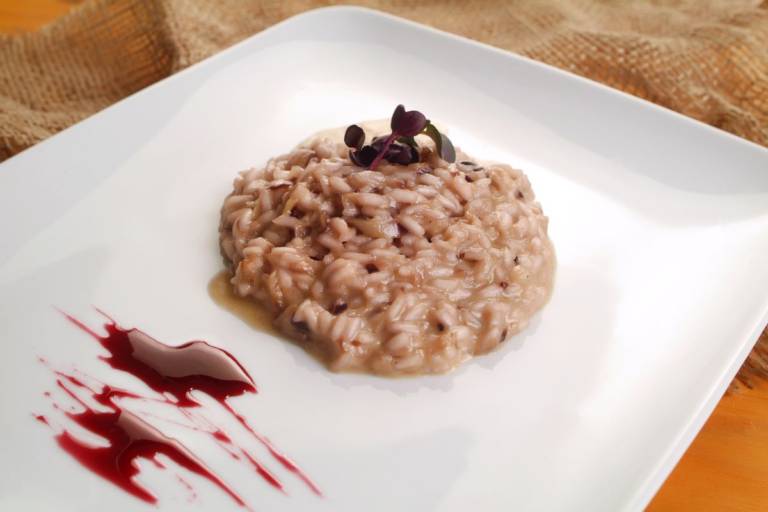
Locate an element on the screen. Image resolution: width=768 pixels, height=512 pixels. light gray shadow on white plate is located at coordinates coord(543,366).